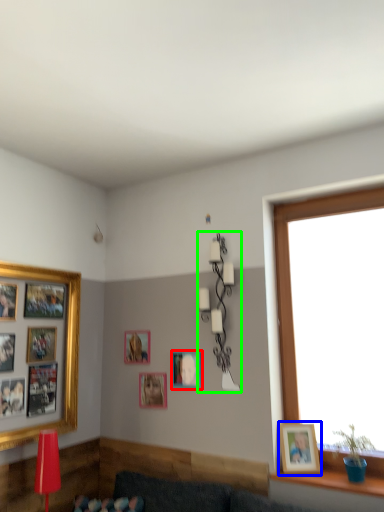
Question: Which object is positioned farthest from picture frame (highlighted by a red box)? Select from picture frame (highlighted by a blue box) and lamp (highlighted by a green box).

Choices:
 (A) picture frame
 (B) lamp

Answer: (A)